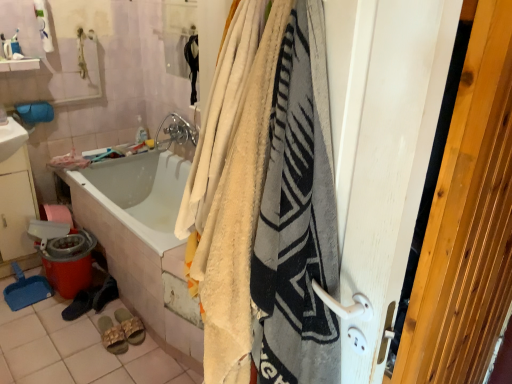
Locate an element on the screen. The image size is (512, 384). vacant space in front of gold fabric slippers at lower center, acting as the 2th footwear starting from the right is located at coordinates (96, 362).